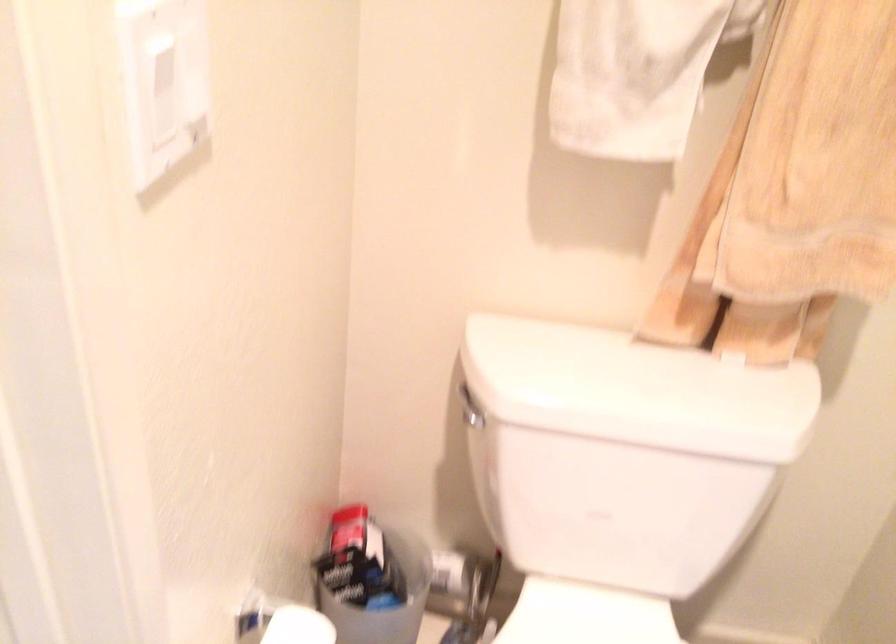
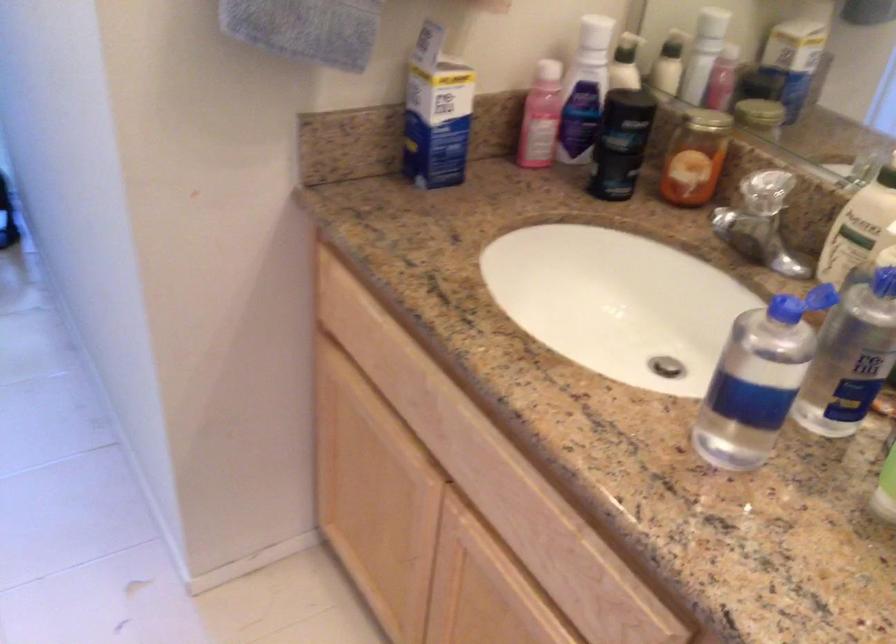
Question: Based on the continuous images, in which direction is the camera rotating? Reply with the corresponding letter.

Choices:
 (A) Left
 (B) Right
 (C) Up
 (D) Down

Answer: (A)